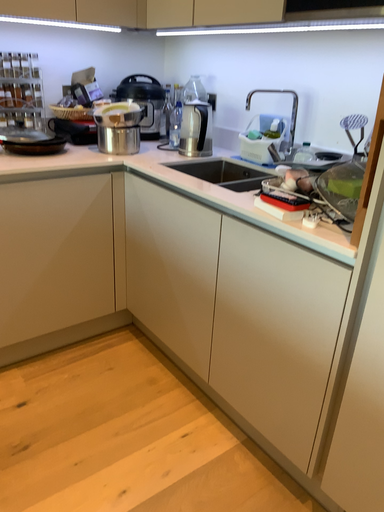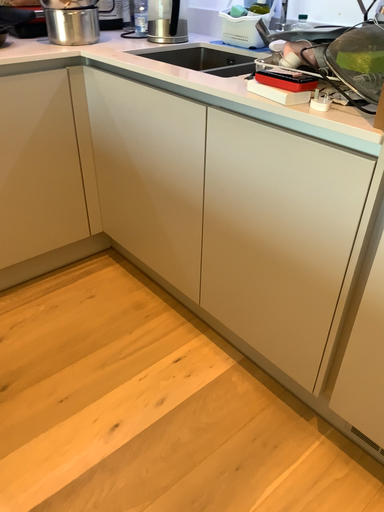
Question: Which way did the camera rotate in the video?

Choices:
 (A) rotated upward
 (B) rotated downward

Answer: (B)